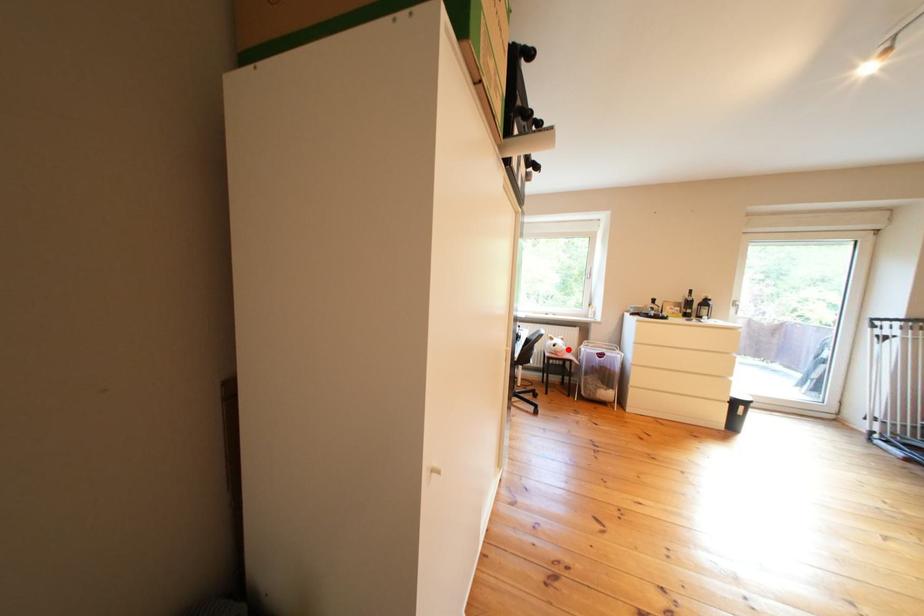
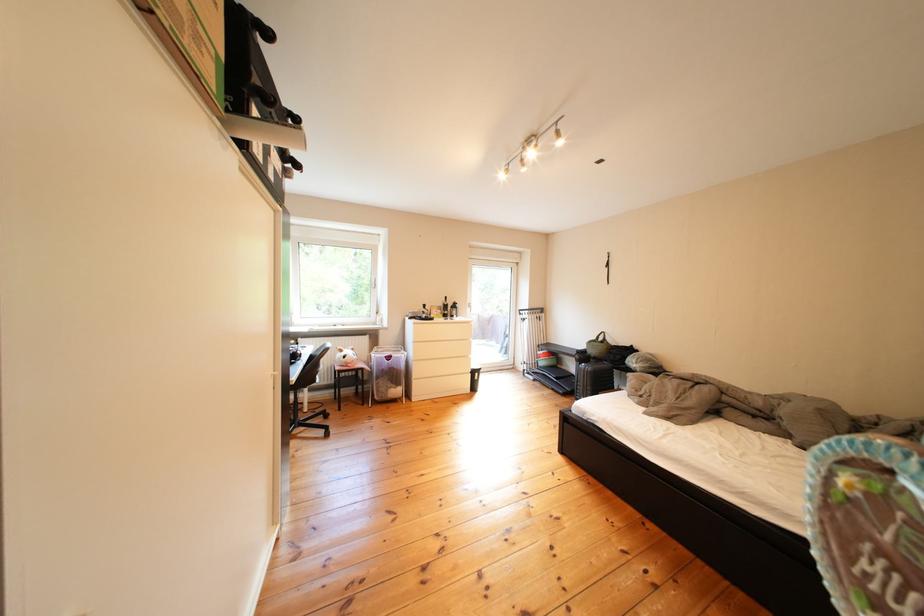
Question: I am providing you with two images of the same scene from different viewpoints. A red point is marked on the first image. Can you still see the location of the red point in image 2?

Choices:
 (A) Yes
 (B) No

Answer: (A)